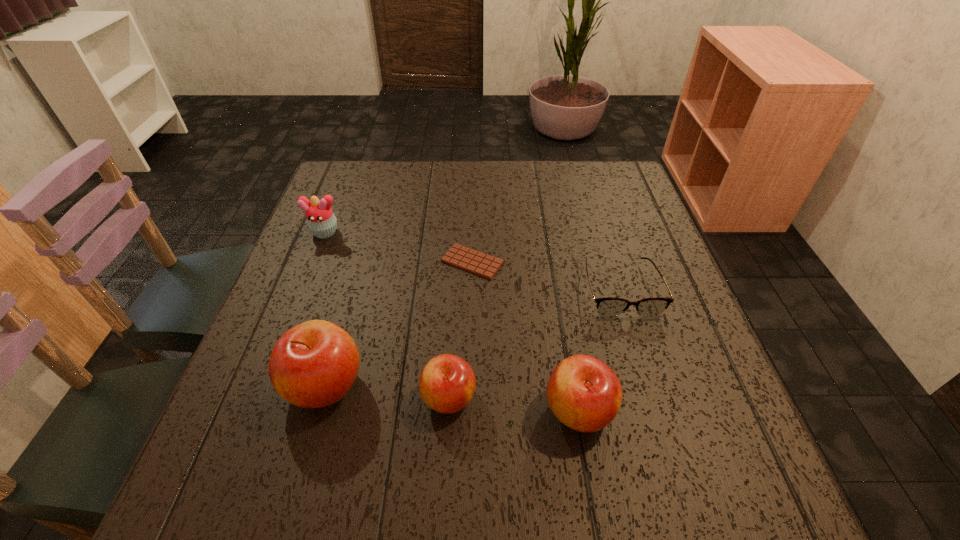
Find the location of a particular element. The width and height of the screenshot is (960, 540). vacant space that satisfies the following two spatial constraints: 1. on the face of the farthest object; 2. on the right side of the shortest apple is located at coordinates (260, 397).

This screenshot has height=540, width=960. Find the location of `free point that satisfies the following two spatial constraints: 1. on the face of the cupcake; 2. on the left side of the rightmost apple`. free point that satisfies the following two spatial constraints: 1. on the face of the cupcake; 2. on the left side of the rightmost apple is located at coordinates (255, 410).

This screenshot has width=960, height=540. I want to click on free point that satisfies the following two spatial constraints: 1. on the face of the tallest apple; 2. on the left side of the farthest object, so click(265, 386).

Locate an element on the screen. free location that satisfies the following two spatial constraints: 1. on the front side of the rightmost apple; 2. on the right side of the candy bar is located at coordinates (469, 410).